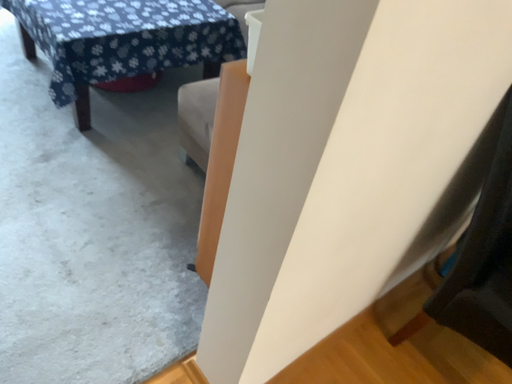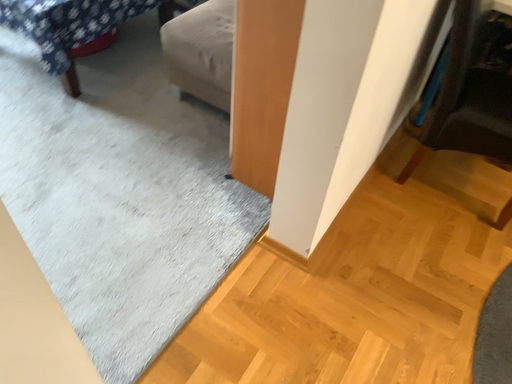
Question: How did the camera likely rotate when shooting the video?

Choices:
 (A) rotated left
 (B) rotated right

Answer: (B)